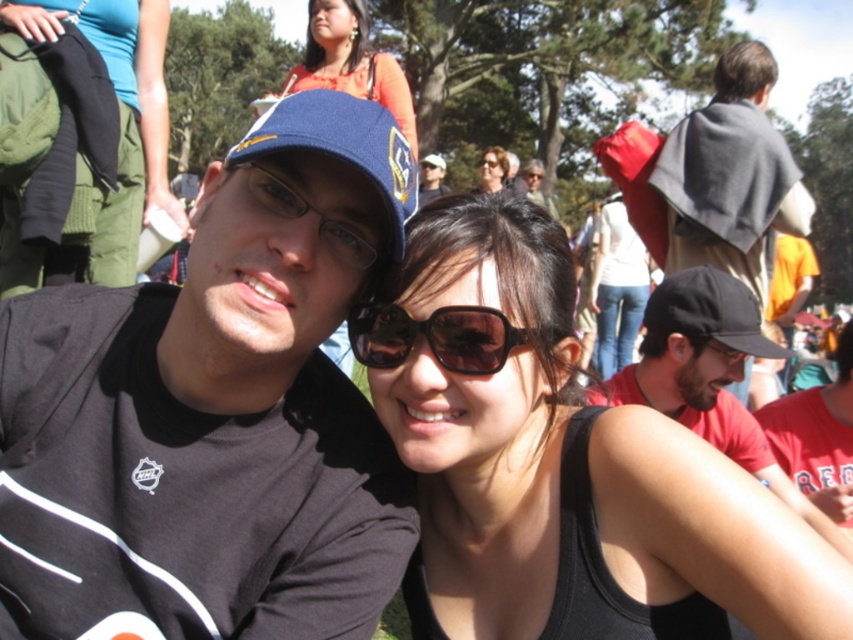
Is point (711, 224) farther from viewer compared to point (274, 182)?

Yes, it is behind point (274, 182).

Is point (758, 116) less distant than point (344, 260)?

That is False.

The height and width of the screenshot is (640, 853). Find the location of `dark gray fabric cape at upper right`. dark gray fabric cape at upper right is located at coordinates (730, 177).

Is green fabric pants at center in front of matte blue cap at upper center?

No, it is not.

Can you confirm if green fabric pants at center is positioned to the right of matte blue cap at upper center?

In fact, green fabric pants at center is to the left of matte blue cap at upper center.

The height and width of the screenshot is (640, 853). In order to click on green fabric pants at center in this screenshot , I will do `click(79, 138)`.

Can you confirm if black fabric baseball cap at right is bigger than matte blue cap at upper center?

Actually, black fabric baseball cap at right might be smaller than matte blue cap at upper center.

Is black fabric baseball cap at right below matte blue cap at upper center?

Yes.

Between point (770, 356) and point (421, 172), which one is positioned in front?

Point (770, 356) is in front.

The image size is (853, 640). What are the coordinates of `black fabric baseball cap at right` in the screenshot? It's located at (709, 310).